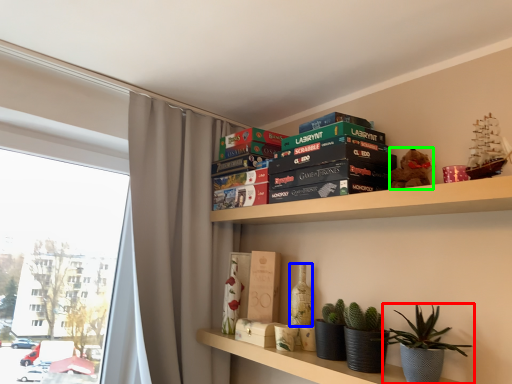
Question: Which object is positioned farthest from houseplant (highlighted by a red box)? Select from bottle (highlighted by a blue box) and toy (highlighted by a green box).

Choices:
 (A) bottle
 (B) toy

Answer: (A)